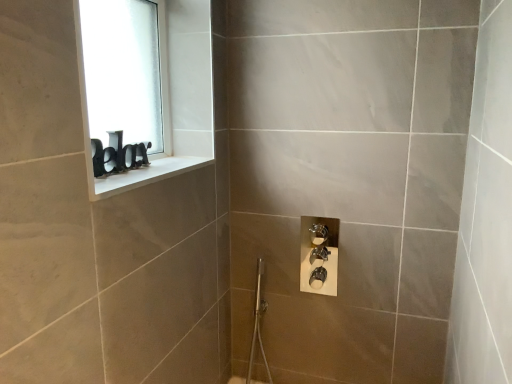
What do you see at coordinates (145, 175) in the screenshot? I see `white glossy window sill at upper left` at bounding box center [145, 175].

Identify the location of white glossy window sill at upper left. This screenshot has height=384, width=512. (145, 175).

The image size is (512, 384). Find the location of `white frosted glass at upper left`. white frosted glass at upper left is located at coordinates (126, 71).

What do you see at coordinates (126, 71) in the screenshot? I see `white frosted glass at upper left` at bounding box center [126, 71].

What is the approximate height of white frosted glass at upper left?

20.21 inches.

Identify the location of white glossy window sill at upper left. (145, 175).

Considering the positions of objects white glossy window sill at upper left and white frosted glass at upper left in the image provided, who is more to the left, white glossy window sill at upper left or white frosted glass at upper left?

white frosted glass at upper left.

Is the depth of white glossy window sill at upper left greater than that of white frosted glass at upper left?

No.

Considering the positions of points (96, 192) and (85, 55), is point (96, 192) farther from camera compared to point (85, 55)?

No, it is in front of (85, 55).

From the image's perspective, is white glossy window sill at upper left positioned above or below white frosted glass at upper left?

Clearly, from the image's perspective, white glossy window sill at upper left is below white frosted glass at upper left.

From a real-world perspective, is white glossy window sill at upper left positioned over white frosted glass at upper left based on gravity?

No, from a real-world perspective, white glossy window sill at upper left is not above white frosted glass at upper left.

Looking at their sizes, would you say white glossy window sill at upper left is wider or thinner than white frosted glass at upper left?

In the image, white glossy window sill at upper left appears to be wider than white frosted glass at upper left.

Is white glossy window sill at upper left taller or shorter than white frosted glass at upper left?

In the image, white glossy window sill at upper left appears to be shorter than white frosted glass at upper left.

Looking at the image, does white glossy window sill at upper left seem bigger or smaller compared to white frosted glass at upper left?

white glossy window sill at upper left is smaller than white frosted glass at upper left.

Is white glossy window sill at upper left not within white frosted glass at upper left?

Yes, white glossy window sill at upper left is located beyond the bounds of white frosted glass at upper left.

Are white glossy window sill at upper left and white frosted glass at upper left located far from each other?

white glossy window sill at upper left is near white frosted glass at upper left, not far away.

Is white glossy window sill at upper left turned away from white frosted glass at upper left?

white glossy window sill at upper left does not have its back to white frosted glass at upper left.

How distant is white glossy window sill at upper left from white frosted glass at upper left?

white glossy window sill at upper left and white frosted glass at upper left are 10.75 inches apart from each other.

The image size is (512, 384). I want to click on window screen that appears above the white glossy window sill at upper left (from the image's perspective), so click(x=126, y=71).

Considering the relative positions of white frosted glass at upper left and white glossy window sill at upper left in the image provided, is white frosted glass at upper left to the left or to the right of white glossy window sill at upper left?

Based on their positions, white frosted glass at upper left is located to the left of white glossy window sill at upper left.

Considering the positions of objects white frosted glass at upper left and white glossy window sill at upper left in the image provided, who is in front, white frosted glass at upper left or white glossy window sill at upper left?

white glossy window sill at upper left is closer to the camera.

Is point (154, 82) farther from viewer compared to point (144, 168)?

Yes, it is.

From the image's perspective, which is below, white frosted glass at upper left or white glossy window sill at upper left?

white glossy window sill at upper left appears lower in the image.

In the scene shown: From a real-world perspective, is white frosted glass at upper left positioned under white glossy window sill at upper left based on gravity?

No.

Can you confirm if white frosted glass at upper left is wider than white glossy window sill at upper left?

Incorrect, the width of white frosted glass at upper left does not surpass that of white glossy window sill at upper left.

Is white frosted glass at upper left taller or shorter than white glossy window sill at upper left?

In the image, white frosted glass at upper left appears to be taller than white glossy window sill at upper left.

Between white frosted glass at upper left and white glossy window sill at upper left, which one has smaller size?

white glossy window sill at upper left.

Do you think white frosted glass at upper left is within white glossy window sill at upper left, or outside of it?

white frosted glass at upper left is outside white glossy window sill at upper left.

Is white frosted glass at upper left with white glossy window sill at upper left?

white frosted glass at upper left and white glossy window sill at upper left are not in contact.

Is white frosted glass at upper left facing towards white glossy window sill at upper left?

Yes, white frosted glass at upper left is oriented towards white glossy window sill at upper left.

Measure the distance between white frosted glass at upper left and white glossy window sill at upper left.

The distance of white frosted glass at upper left from white glossy window sill at upper left is 27.30 centimeters.

Find the location of a particular element. The image size is (512, 384). window screen that is on the left side of white glossy window sill at upper left is located at coordinates (126, 71).

The image size is (512, 384). Identify the location of window screen lying above the white glossy window sill at upper left (from the image's perspective). (126, 71).

You are a GUI agent. You are given a task and a screenshot of the screen. Output one action in this format:
    pyautogui.click(x=<x>, y=<y>)
    Task: Click on the window screen that appears above the white glossy window sill at upper left (from a real-world perspective)
    The height and width of the screenshot is (384, 512).
    Given the screenshot: What is the action you would take?
    pyautogui.click(x=126, y=71)